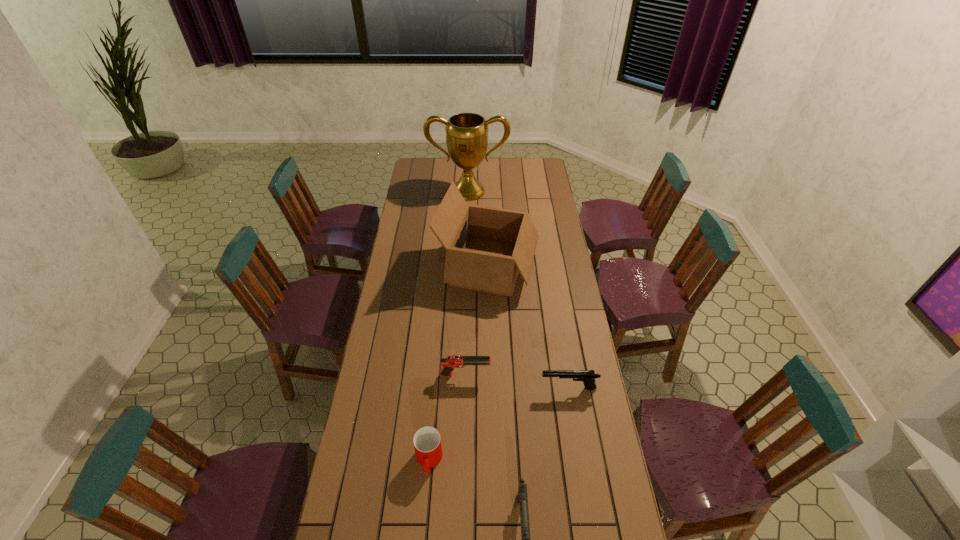
Identify which object is located as the nearest to the fourth nearest object. Please provide its 2D coordinates. Your answer should be formatted as a tuple, i.e. [(x, y)], where the tuple contains the x and y coordinates of a point satisfying the conditions above.

[(588, 377)]

Identify which object is located as the fourth nearest to the box. Please provide its 2D coordinates. Your answer should be formatted as a tuple, i.e. [(x, y)], where the tuple contains the x and y coordinates of a point satisfying the conditions above.

[(427, 442)]

In order to click on gun that is the closest to the nearest gun in this screenshot , I will do `click(588, 377)`.

Identify which gun is the third nearest to the tallest object. Please provide its 2D coordinates. Your answer should be formatted as a tuple, i.e. [(x, y)], where the tuple contains the x and y coordinates of a point satisfying the conditions above.

[(522, 491)]

Find the location of a particular element. free point that satisfies the following two spatial constraints: 1. at the aiming end of the third nearest object; 2. on the side of the second nearest object with the handle is located at coordinates (581, 460).

The width and height of the screenshot is (960, 540). In order to click on free spot that satisfies the following two spatial constraints: 1. on the surface of the second tallest object with symbols; 2. on the left side of the tallest object in this screenshot , I will do `click(466, 267)`.

Locate an element on the screen. Image resolution: width=960 pixels, height=540 pixels. free location that satisfies the following two spatial constraints: 1. at the aiming end of the second farthest gun; 2. on the side of the cup with the handle is located at coordinates (581, 460).

Where is `free spot that satisfies the following two spatial constraints: 1. at the aiming end of the second nearest gun; 2. on the side of the cup with the handle`? This screenshot has width=960, height=540. free spot that satisfies the following two spatial constraints: 1. at the aiming end of the second nearest gun; 2. on the side of the cup with the handle is located at coordinates (581, 460).